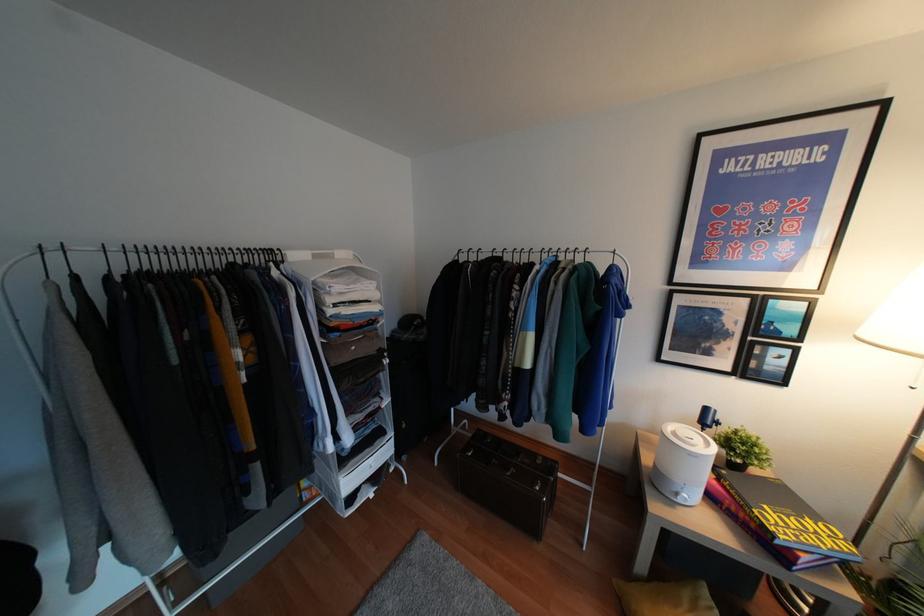
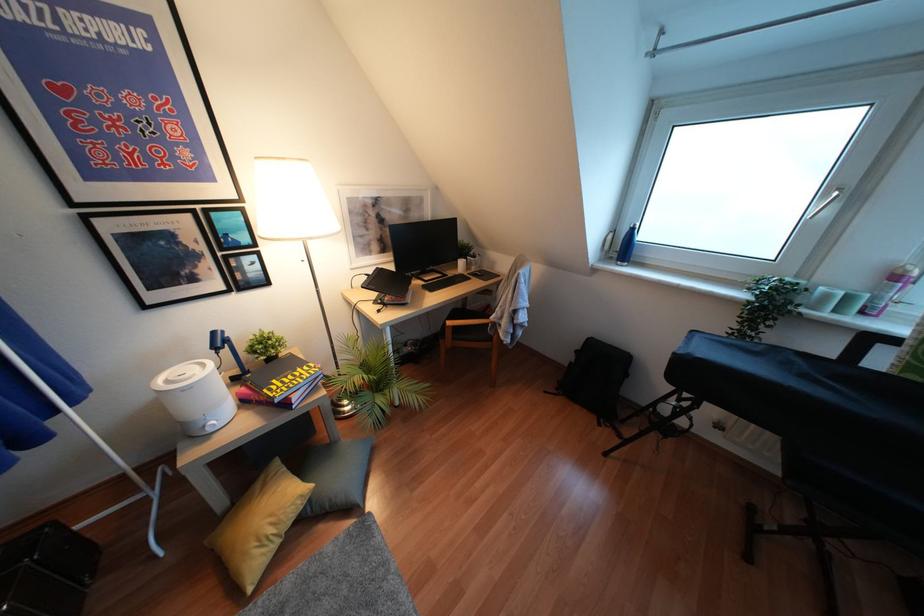
Based on the continuous images, in which direction is the camera rotating?

The rotation direction of the camera is right-down.